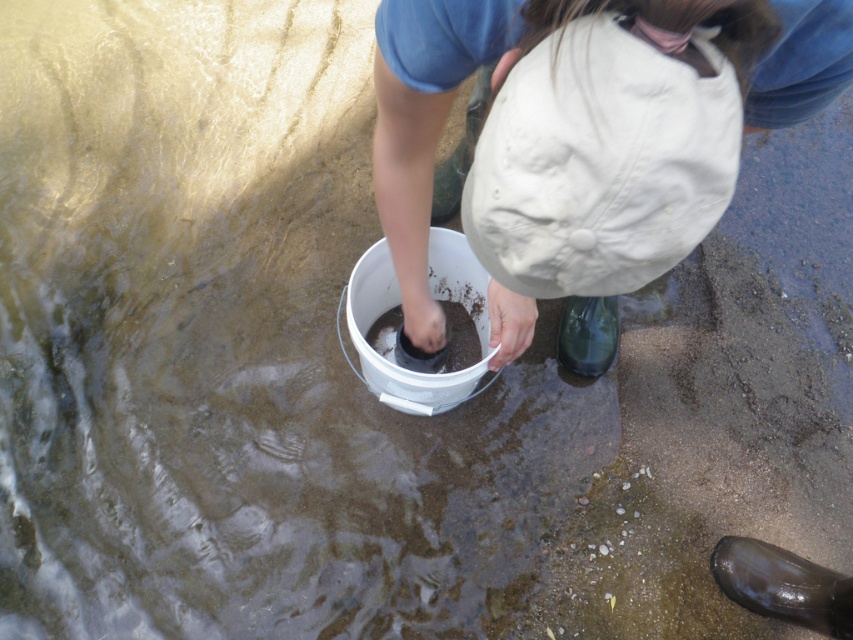
Question: Which of the following is the closest to the observer?

Choices:
 (A) (848, 74)
 (B) (599, 349)

Answer: (A)

Question: Is white matte hat at center bigger than transparent plastic bottle at lower right?

Choices:
 (A) no
 (B) yes

Answer: (B)

Question: Is white matte hat at center below transparent plastic bottle at lower right?

Choices:
 (A) no
 (B) yes

Answer: (A)

Question: Where is white matte hat at center located in relation to transparent plastic bottle at lower right in the image?

Choices:
 (A) above
 (B) below

Answer: (A)

Question: Among these points, which one is farthest from the camera?

Choices:
 (A) pyautogui.click(x=495, y=49)
 (B) pyautogui.click(x=605, y=310)

Answer: (B)